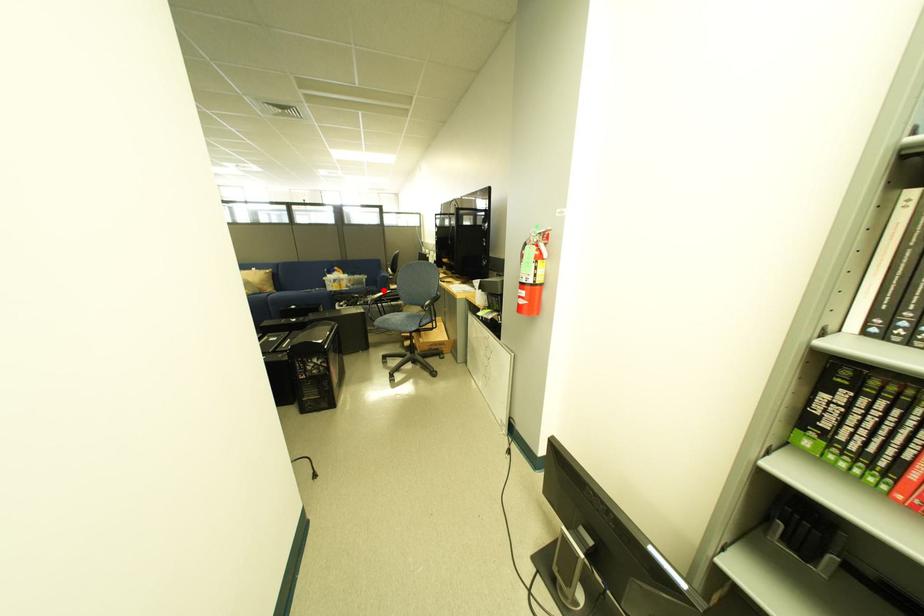
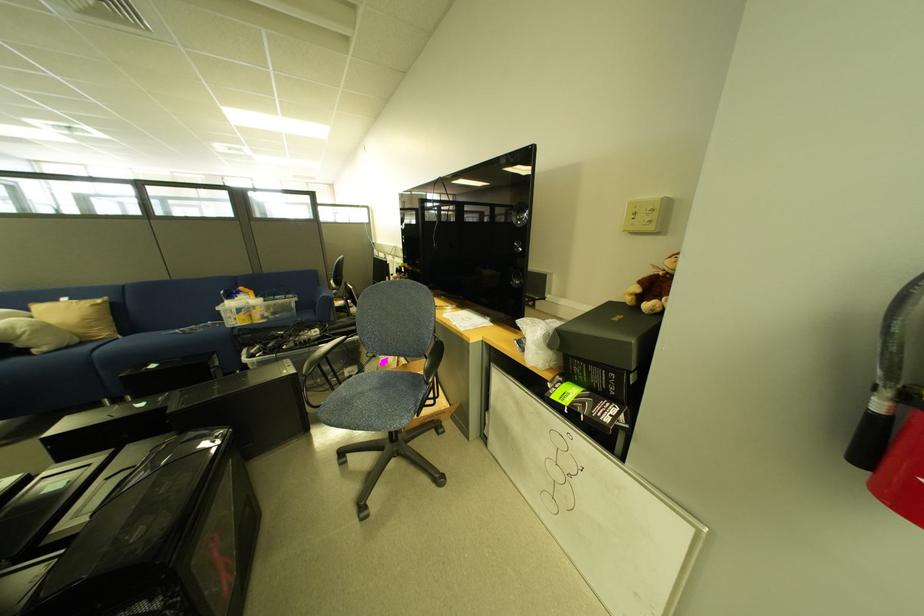
Question: A red point is marked in image1. In image2, is the corresponding 3D point closer to the camera or farther? Reply with the corresponding letter.

Choices:
 (A) The corresponding 3D point is closer.
 (B) The corresponding 3D point is farther.

Answer: (A)